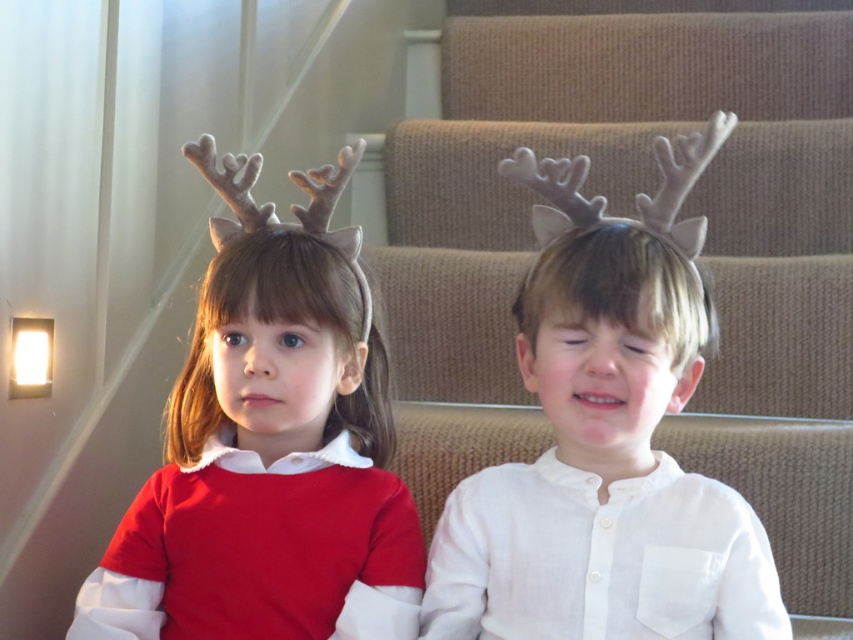
You are a parent trying to take a photo of your children. You notice the matte red sweater at left and the white matte antlers at center in the frame. Which object might block the view of the other if you move the camera slightly to the right?

The matte red sweater at left might block the view of the white matte antlers at center if you move the camera slightly to the right because the sweater is wider than the antlers.

You are a parent trying to dress your child in the correct clothing. You have the matte red sweater at left and the white matte antlers at center. Which item is bigger?

The matte red sweater at left is larger in size than the white matte antlers at center.